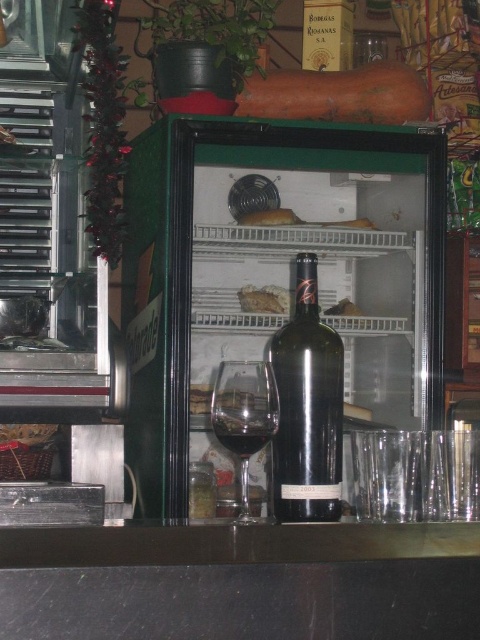
Question: Is the position of black granite counter at lower center more distant than that of white crumbly bread at center?

Choices:
 (A) yes
 (B) no

Answer: (B)

Question: Does transparent glass at center lie in front of brown crumbly bread at center?

Choices:
 (A) no
 (B) yes

Answer: (B)

Question: Is black granite counter at lower center to the left of brown crumbly bread at center from the viewer's perspective?

Choices:
 (A) yes
 (B) no

Answer: (B)

Question: Estimate the real-world distances between objects in this image. Which object is farther from the black glass bottle at center?

Choices:
 (A) bread at center
 (B) black granite counter at lower center
 (C) brown crumbly bread at center

Answer: (A)

Question: Among these objects, which one is nearest to the camera?

Choices:
 (A) wooden log at upper center
 (B) brown crumbly bread at center
 (C) white crumbly bread at center

Answer: (A)

Question: Which object is the closest to the wooden log at upper center?

Choices:
 (A) black granite counter at lower center
 (B) bread at center
 (C) brown crumbly bread at center
 (D) white crumbly bread at center

Answer: (D)